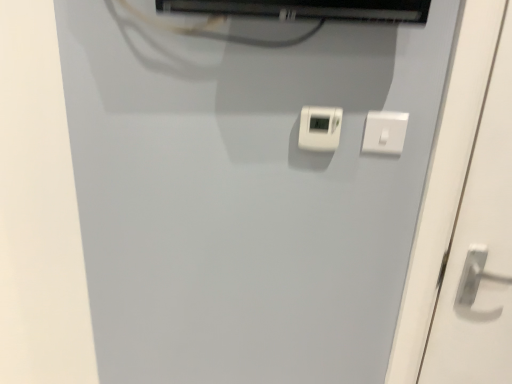
This screenshot has height=384, width=512. Describe the element at coordinates (320, 128) in the screenshot. I see `white plastic thermostat at center` at that location.

I want to click on white plastic thermostat at center, so click(x=320, y=128).

In order to click on white plastic thermostat at center in this screenshot , I will do `click(320, 128)`.